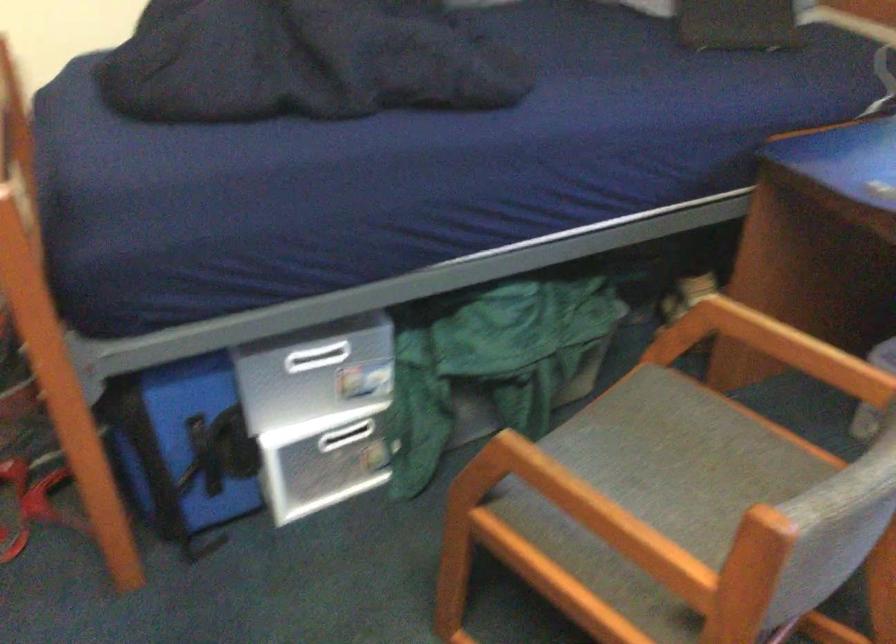
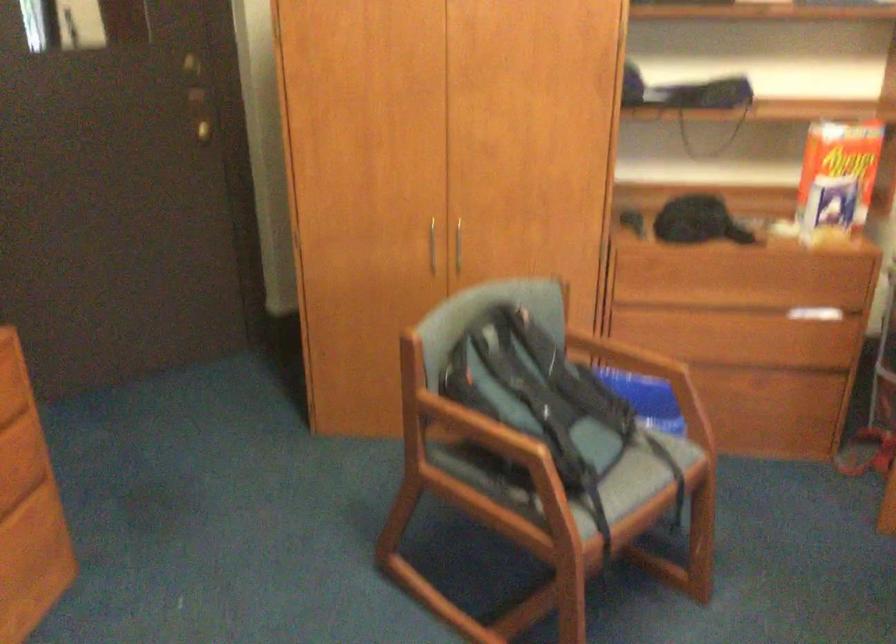
Question: Based on the continuous images, in which direction is the camera rotating? Reply with the corresponding letter.

Choices:
 (A) Left
 (B) Right
 (C) Up
 (D) Down

Answer: (A)